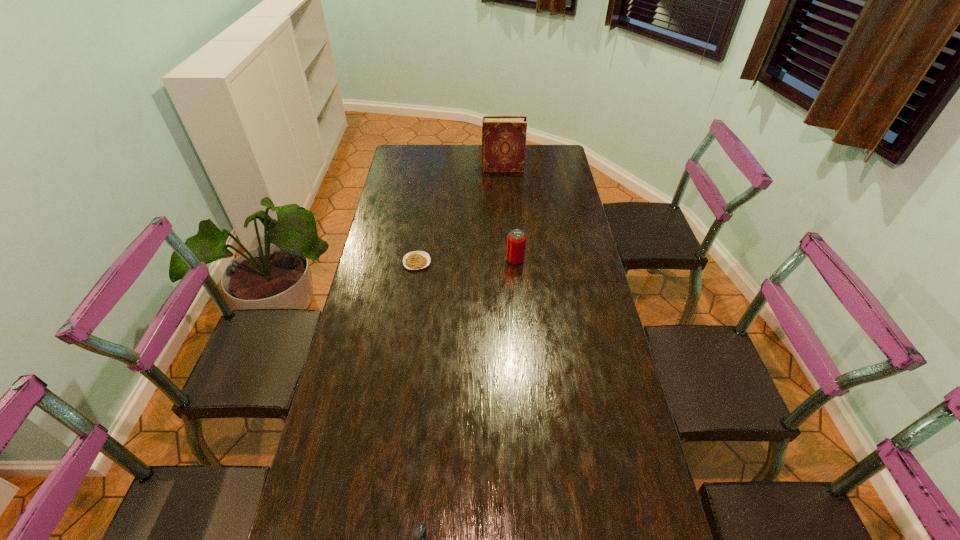
Find the location of `free spot between the leftmost object and the farthest object`. free spot between the leftmost object and the farthest object is located at coordinates (460, 215).

Point out which object is positioned as the third nearest to the third object from right to left. Please provide its 2D coordinates. Your answer should be formatted as a tuple, i.e. [(x, y)], where the tuple contains the x and y coordinates of a point satisfying the conditions above.

[(503, 137)]

Where is `the second closest object to the legume`? The width and height of the screenshot is (960, 540). the second closest object to the legume is located at coordinates (503, 137).

Locate an element on the screen. The width and height of the screenshot is (960, 540). free space that satisfies the following two spatial constraints: 1. on the spine side of the tallest object; 2. on the right side of the second tallest object is located at coordinates (509, 260).

The image size is (960, 540). In order to click on vacant space that satisfies the following two spatial constraints: 1. on the spine side of the farthest object; 2. on the back side of the can in this screenshot , I will do `click(509, 260)`.

Locate an element on the screen. This screenshot has width=960, height=540. vacant area in the image that satisfies the following two spatial constraints: 1. on the spine side of the hardback book; 2. on the back side of the second tallest object is located at coordinates (509, 260).